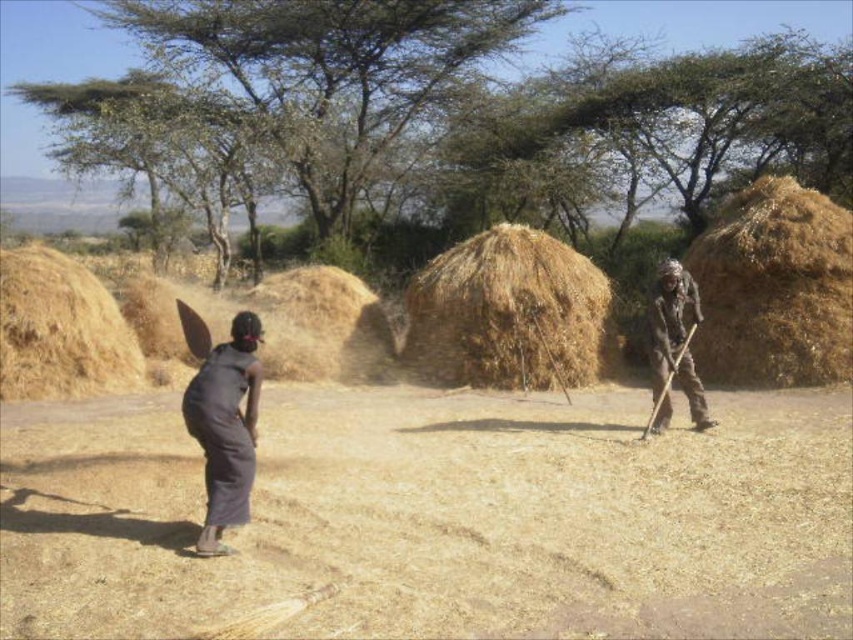
You are a farmer in the savanna who needs to decide which item to use for covering crops. The brown straw at left and the dark brown fabric at right are available. Which one is bigger and thus more suitable for covering a larger area?

The brown straw at left is larger in size than the dark brown fabric at right, making it more suitable for covering a larger area.

You are a farmer in the savanna who needs to determine which item is wider between the brown straw at left and the dark brown fabric at right. Based on the scene, which one is wider?

The brown straw at left is wider than the dark brown fabric at right according to the description.